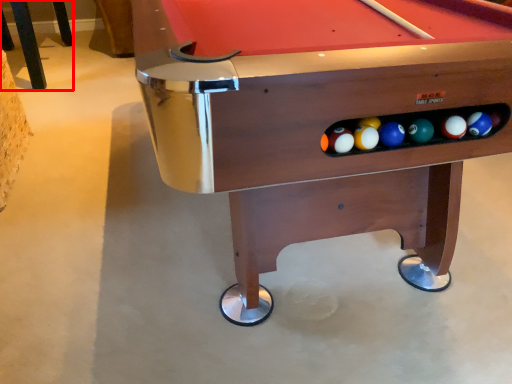
Question: From the image's perspective, what is the correct spatial relationship of furniture (annotated by the red box) in relation to billiard table?

Choices:
 (A) below
 (B) above

Answer: (B)